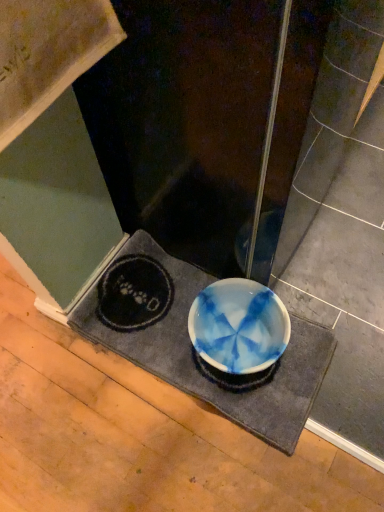
Locate an element on the screen. free space to the left of blue tie-dye fabric bath mat at center is located at coordinates (61, 394).